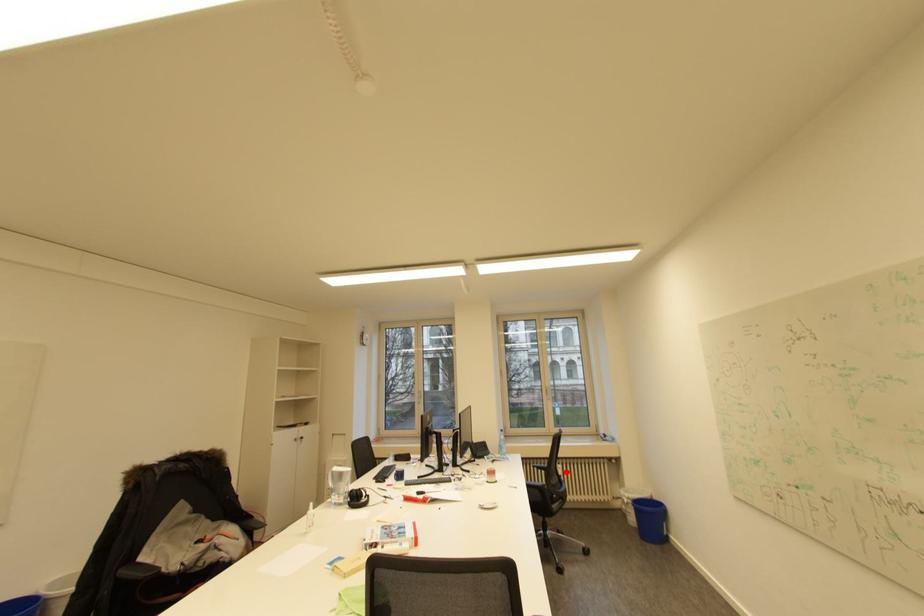
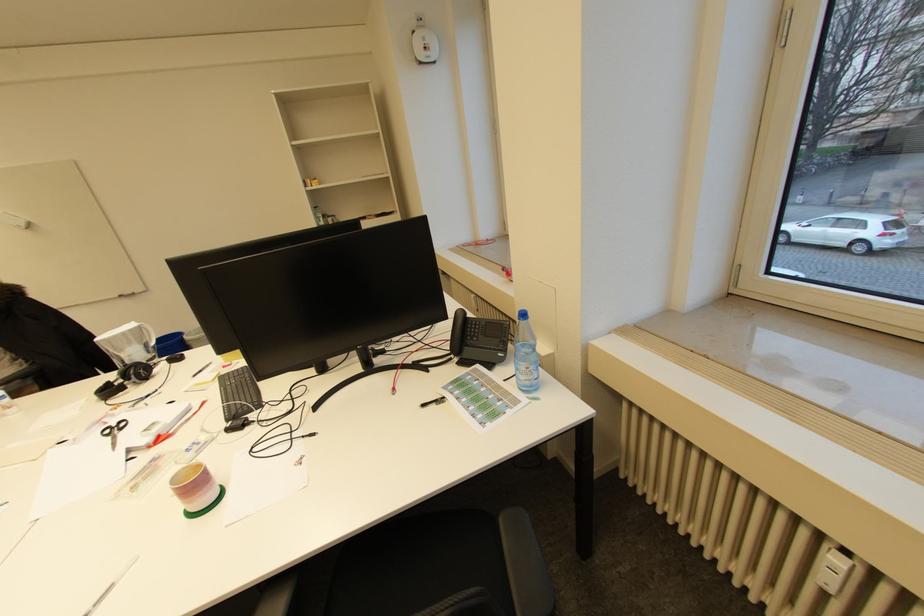
The point at the highlighted location is marked in the first image. Where is the corresponding point in the second image?

(833, 580)